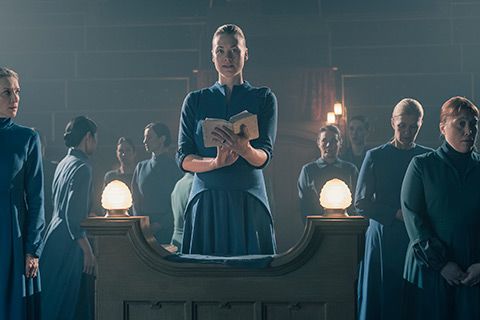
Identify the location of lights. (110, 203), (333, 196), (342, 106), (331, 118).